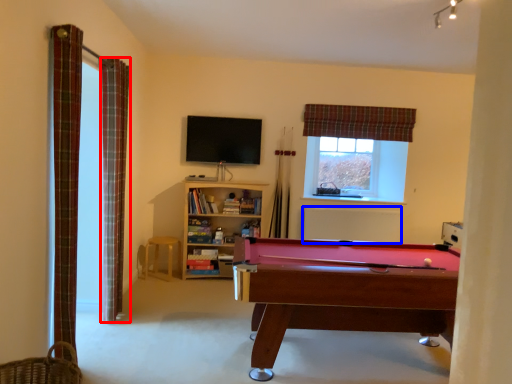
Question: Which object appears farthest to the camera in this image, curtain (highlighted by a red box) or radiator (highlighted by a blue box)?

Choices:
 (A) curtain
 (B) radiator

Answer: (B)